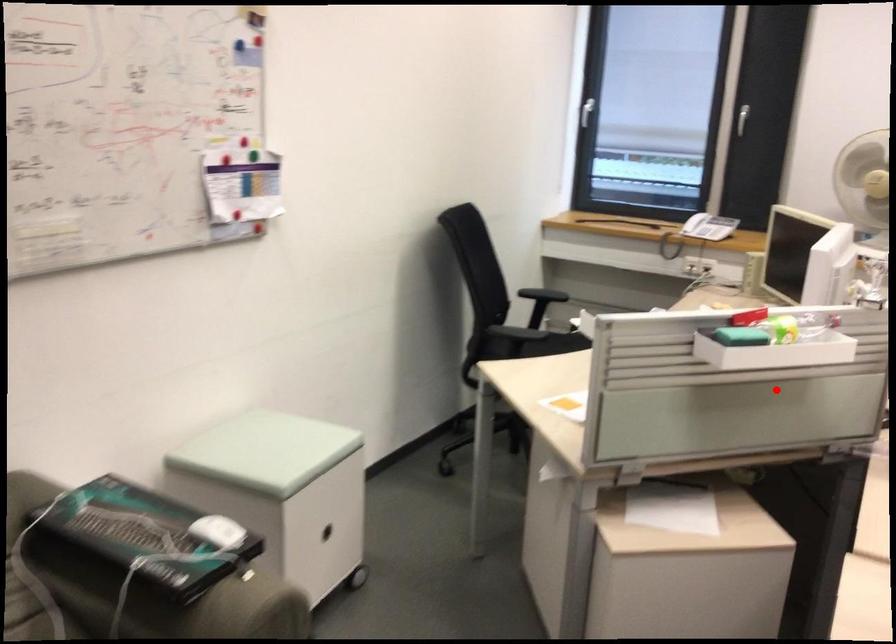
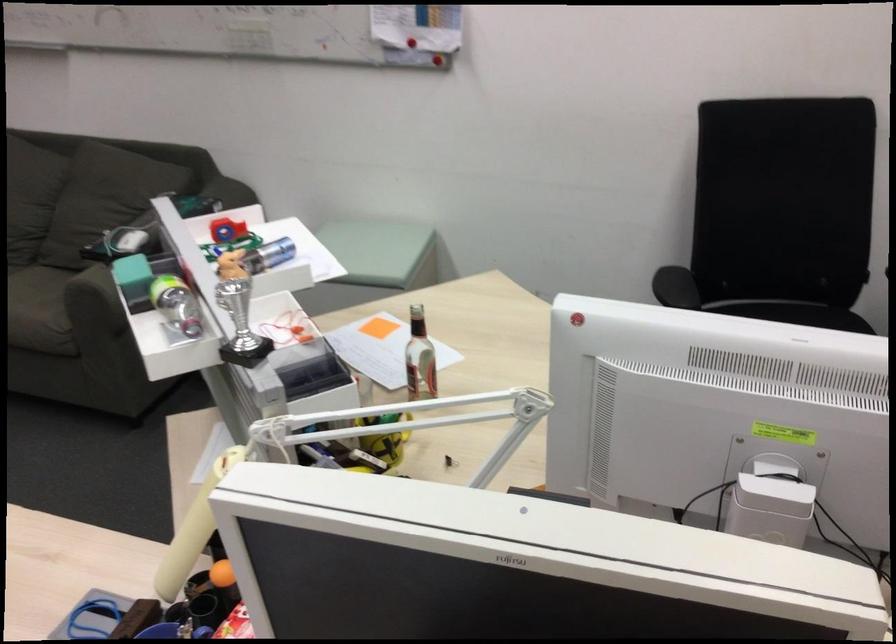
The point at the highlighted location is marked in the first image. Where is the corresponding point in the second image?

(367, 460)